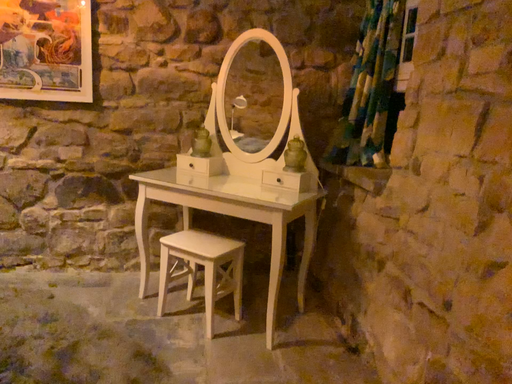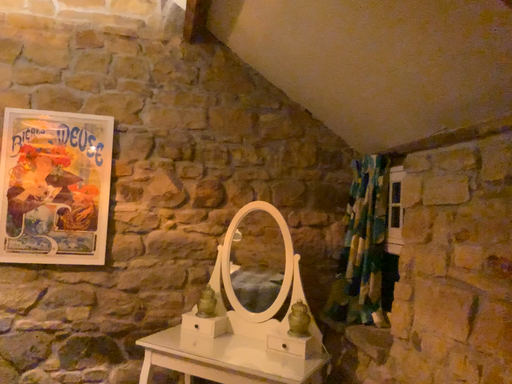
Question: Which way did the camera rotate in the video?

Choices:
 (A) rotated downward
 (B) rotated upward

Answer: (B)